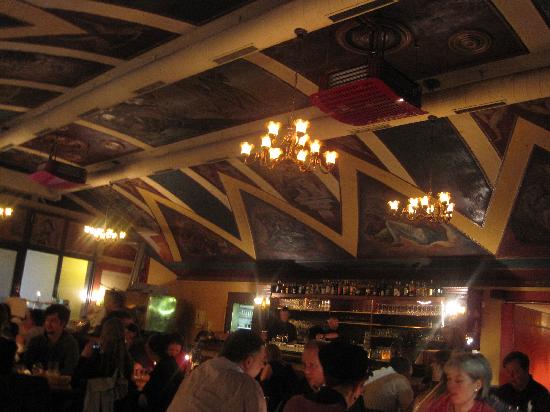
Where is `vents`? vents is located at coordinates (340, 71).